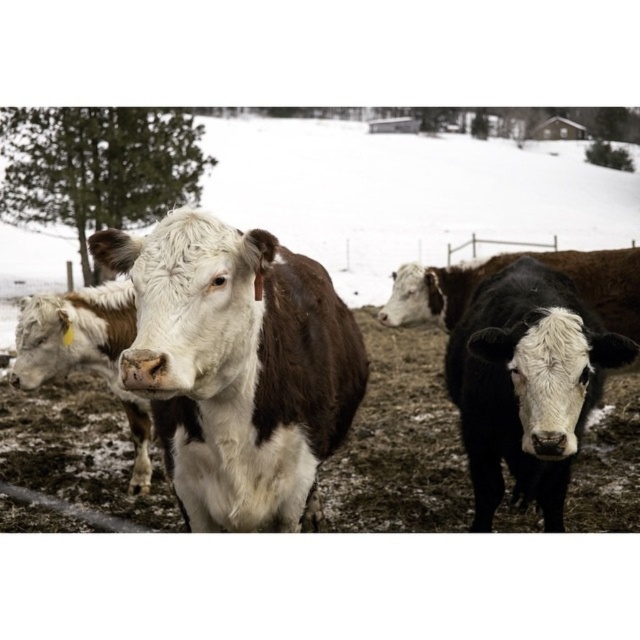
Consider the image. Is white fur cow at center thinner than brown/white fur at center?

In fact, white fur cow at center might be wider than brown/white fur at center.

Is point (355, 449) behind point (225, 253)?

That is True.

Locate an element on the screen. This screenshot has height=640, width=640. white fur cow at center is located at coordinates (225, 368).

Image resolution: width=640 pixels, height=640 pixels. What do you see at coordinates (236, 365) in the screenshot? I see `brown/white fur at center` at bounding box center [236, 365].

Who is taller, brown/white fur at center or white matte cow at center?

With more height is white matte cow at center.

Identify the location of brown/white fur at center. This screenshot has width=640, height=640. (236, 365).

Where is `brown/white fur at center`? Image resolution: width=640 pixels, height=640 pixels. brown/white fur at center is located at coordinates (x=236, y=365).

Image resolution: width=640 pixels, height=640 pixels. Describe the element at coordinates (225, 368) in the screenshot. I see `white fur cow at center` at that location.

I want to click on white fur cow at center, so click(225, 368).

Where is `white fur cow at center`? The width and height of the screenshot is (640, 640). white fur cow at center is located at coordinates (225, 368).

Image resolution: width=640 pixels, height=640 pixels. I want to click on white fur cow at center, so click(x=225, y=368).